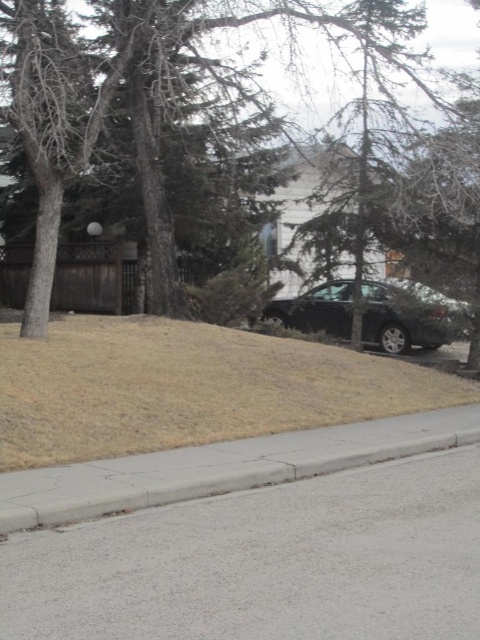
Question: Can you confirm if gray concrete curb at lower center is positioned above brown textured tree at center?

Choices:
 (A) no
 (B) yes

Answer: (A)

Question: Which point is closer to the camera taking this photo?

Choices:
 (A) (386, 284)
 (B) (347, 13)

Answer: (A)

Question: Is brown dry grass at lower center thinner than gray concrete curb at lower center?

Choices:
 (A) no
 (B) yes

Answer: (A)

Question: From the image, what is the correct spatial relationship of gray concrete curb at lower center in relation to brown textured tree at center?

Choices:
 (A) above
 (B) below

Answer: (B)

Question: Which object is positioned closest to the glossy black car at center?

Choices:
 (A) brown textured tree at center
 (B) brown dry grass at lower center

Answer: (B)

Question: Which of the following is the closest to the observer?

Choices:
 (A) (418, 390)
 (B) (81, 484)
 (C) (342, 321)
 (D) (226, 13)

Answer: (B)